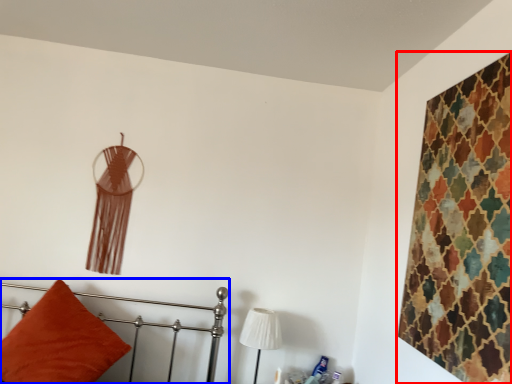
Question: Among these objects, which one is nearest to the camera, textile (highlighted by a red box) or furniture (highlighted by a blue box)?

Choices:
 (A) textile
 (B) furniture

Answer: (A)